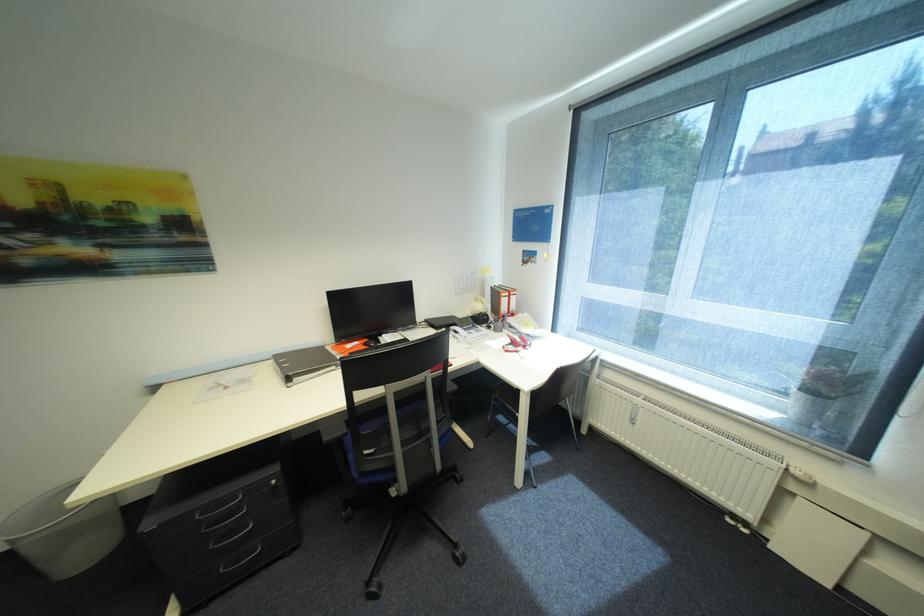
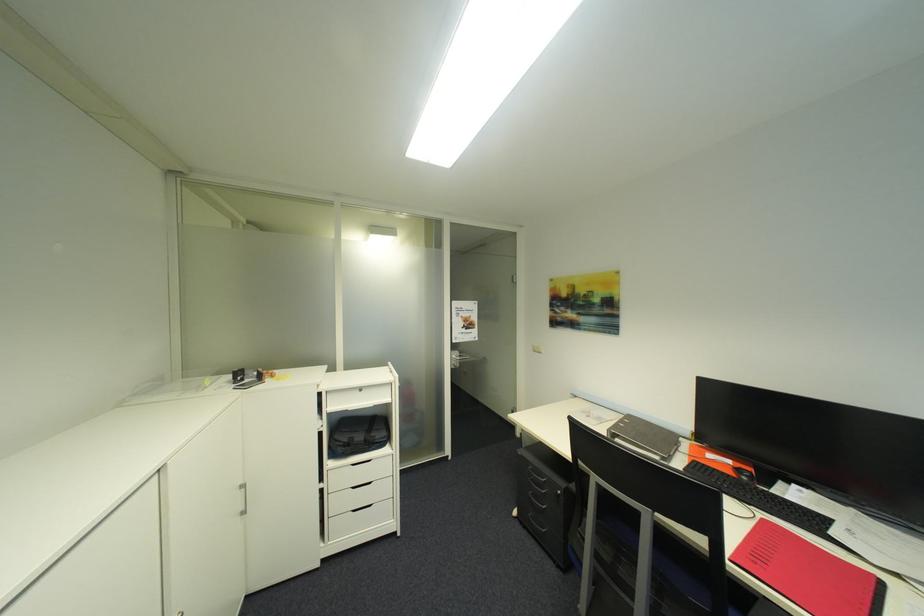
Locate, in the second image, the point that corresponds to [365,342] in the first image.

(736, 463)